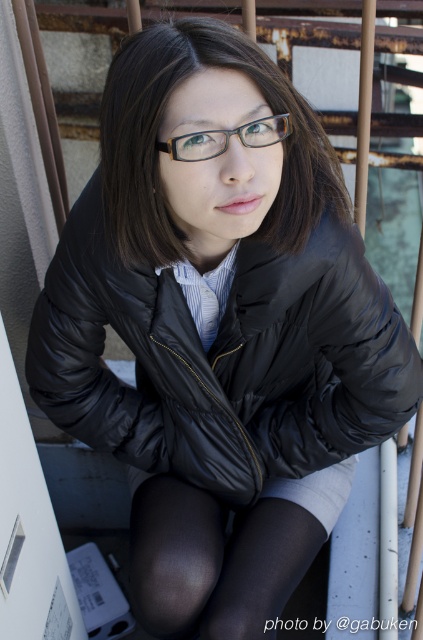
What is located at the coordinates point (159, 141)?

The matte black jacket at center is located at point (159, 141).

You are a fashion designer analyzing this outfit. The matte black jacket at center and clear plastic glasses at center are key elements. Which of these two items is positioned higher on the person?

The matte black jacket at center is taller than the clear plastic glasses at center, so the jacket is positioned higher on the person.